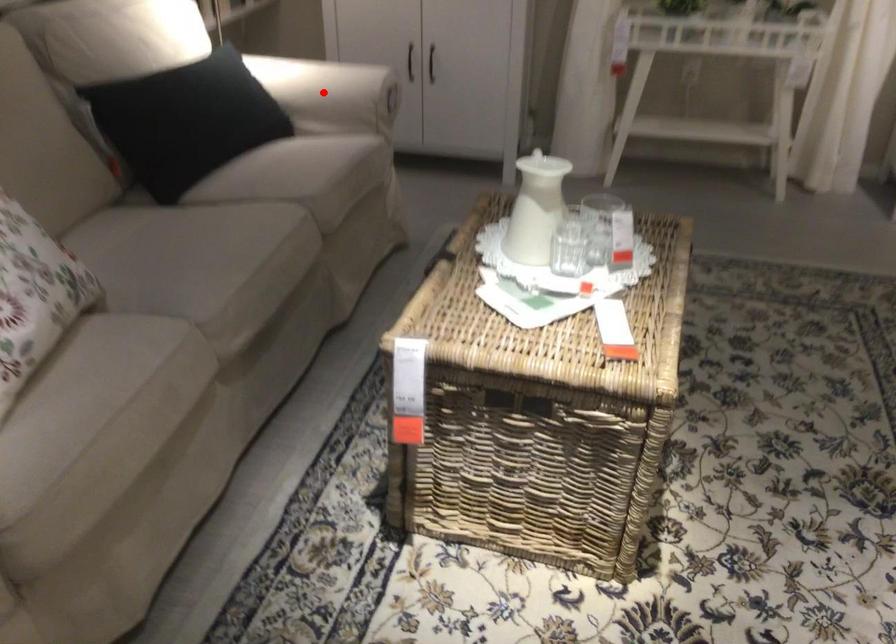
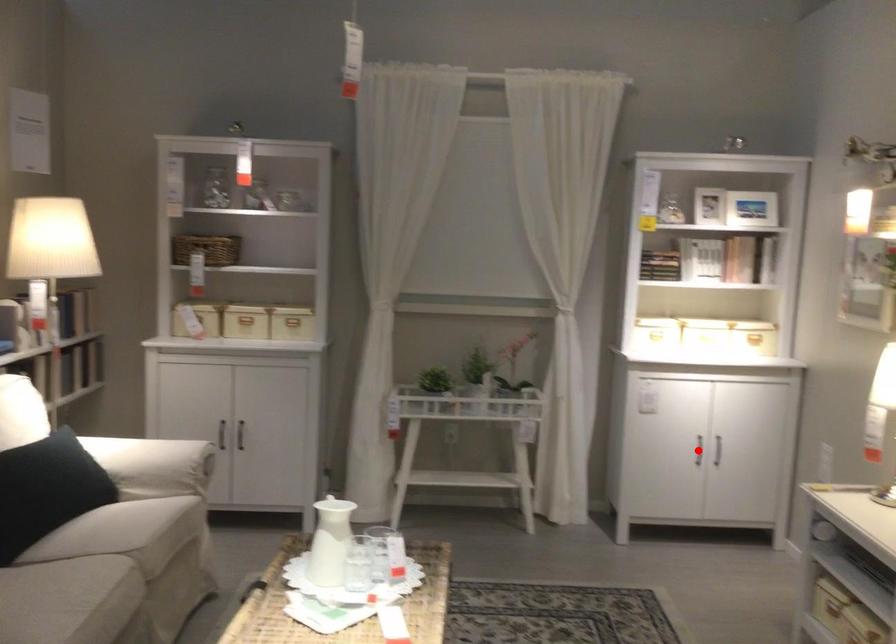
I am providing you with two images of the same scene from different viewpoints. A red point is marked on the first image and another point is marked on the second image. Do the highlighted points in image1 and image2 indicate the same real-world spot?

No